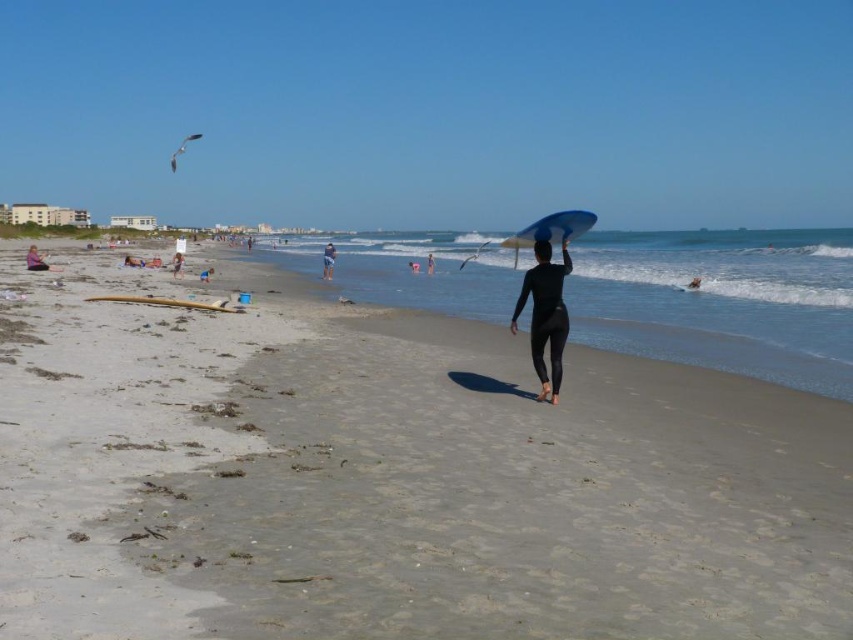
Is black matte wetsuit at center to the left of white cotton shirt at center from the viewer's perspective?

No, black matte wetsuit at center is not to the left of white cotton shirt at center.

Is the position of black matte wetsuit at center more distant than that of white cotton shirt at center?

No, black matte wetsuit at center is closer to the viewer.

Between point (541, 392) and point (180, 260), which one is positioned in front?

Point (541, 392) is in front.

I want to click on black matte wetsuit at center, so click(x=544, y=316).

Can you confirm if smooth black wetsuit at center is wider than black wetsuit at center?

Incorrect, smooth black wetsuit at center's width does not surpass black wetsuit at center's.

Is smooth black wetsuit at center to the right of black wetsuit at center from the viewer's perspective?

Indeed, smooth black wetsuit at center is positioned on the right side of black wetsuit at center.

Does point (697, 284) lie in front of point (415, 266)?

That is True.

The width and height of the screenshot is (853, 640). In order to click on smooth black wetsuit at center in this screenshot , I will do `click(693, 284)`.

Is point (529, 499) closer to viewer compared to point (511, 237)?

Yes.

Does smooth sand at center appear on the right side of blue matte surfboard at center?

No, smooth sand at center is not to the right of blue matte surfboard at center.

Locate an element on the screen. smooth sand at center is located at coordinates (389, 476).